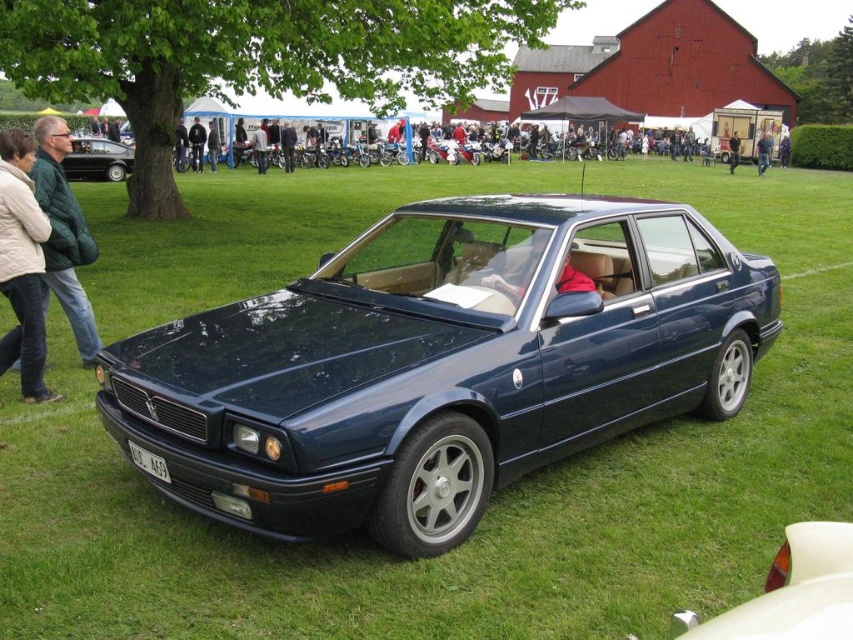
Can you confirm if glossy white car at lower right is positioned to the right of shiny black sedan at left?

Yes, glossy white car at lower right is to the right of shiny black sedan at left.

Is glossy white car at lower right bigger than shiny black sedan at left?

No, glossy white car at lower right is not bigger than shiny black sedan at left.

Where is `glossy white car at lower right`? The image size is (853, 640). glossy white car at lower right is located at coordinates (792, 592).

Measure the distance between point (x=201, y=157) and camera.

A distance of 98.30 feet exists between point (x=201, y=157) and camera.

Is black leather jacket at center bigger than blue fabric jacket at center?

No.

Who is more distant from viewer, (199, 124) or (759, 163)?

The point (759, 163) is more distant.

Identify the location of black leather jacket at center. The width and height of the screenshot is (853, 640). (196, 145).

Between white plastic license plate at center and blue fabric jacket at center, which one is positioned lower?

white plastic license plate at center is lower down.

Does white plastic license plate at center have a lesser height compared to blue fabric jacket at center?

Indeed, white plastic license plate at center has a lesser height compared to blue fabric jacket at center.

Does point (155, 461) lie behind point (756, 163)?

No, (155, 461) is closer to viewer.

Identify the location of white plastic license plate at center. (148, 461).